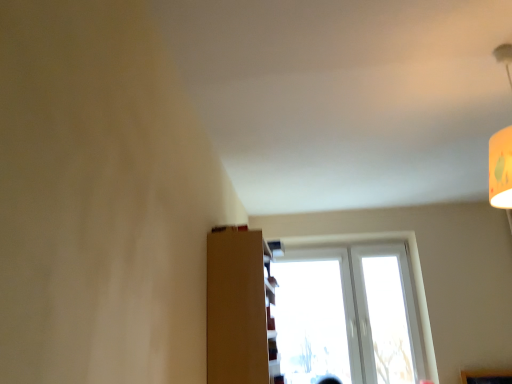
Question: In the image, is brown matte shelf at center positioned in front of or behind white plastic window at center?

Choices:
 (A) front
 (B) behind

Answer: (A)

Question: From their relative heights in the image, would you say brown matte shelf at center is taller or shorter than white plastic window at center?

Choices:
 (A) tall
 (B) short

Answer: (B)

Question: Considering the relative positions of brown matte shelf at center and white plastic window at center in the image provided, is brown matte shelf at center to the left or to the right of white plastic window at center?

Choices:
 (A) right
 (B) left

Answer: (B)

Question: Considering their positions, is white plastic window at center located in front of or behind brown matte shelf at center?

Choices:
 (A) behind
 (B) front

Answer: (A)

Question: From the image's perspective, is white plastic window at center positioned above or below brown matte shelf at center?

Choices:
 (A) above
 (B) below

Answer: (B)

Question: Looking at the image, does white plastic window at center seem bigger or smaller compared to brown matte shelf at center?

Choices:
 (A) small
 (B) big

Answer: (B)

Question: From their relative heights in the image, would you say white plastic window at center is taller or shorter than brown matte shelf at center?

Choices:
 (A) tall
 (B) short

Answer: (A)